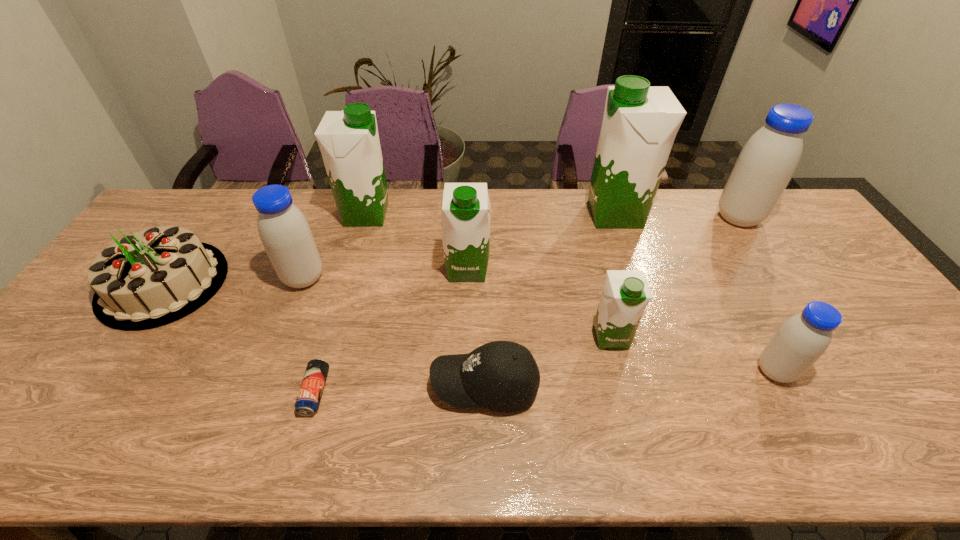
At what (x,y) coordinates should I click in order to perform the action: click on free point between the blue beer can and the second nearest green soya milk. Please return your answer as a coordinate pair (x, y). The width and height of the screenshot is (960, 540). Looking at the image, I should click on (392, 331).

Locate an element on the screen. This screenshot has height=540, width=960. free space between the smallest green soya milk and the leftmost green soya milk is located at coordinates (489, 275).

Identify the location of object that is the fourth closest one to the second biggest green soya milk. The height and width of the screenshot is (540, 960). (310, 392).

Locate an element on the screen. This screenshot has width=960, height=540. object identified as the eighth closest to the tallest object is located at coordinates (310, 392).

Where is `soya milk that is the seventh closest to the birthday cake`? soya milk that is the seventh closest to the birthday cake is located at coordinates (768, 160).

This screenshot has height=540, width=960. I want to click on soya milk identified as the second closest to the shortest object, so click(465, 220).

Identify which green soya milk is the closest to the second blue soya milk from left to right. Please provide its 2D coordinates. Your answer should be formatted as a tuple, i.e. [(x, y)], where the tuple contains the x and y coordinates of a point satisfying the conditions above.

[(626, 293)]

Point out which green soya milk is positioned as the third nearest to the birthday cake. Please provide its 2D coordinates. Your answer should be formatted as a tuple, i.e. [(x, y)], where the tuple contains the x and y coordinates of a point satisfying the conditions above.

[(626, 293)]

Select which blue soya milk is the closest to the ninth tallest object. Please provide its 2D coordinates. Your answer should be formatted as a tuple, i.e. [(x, y)], where the tuple contains the x and y coordinates of a point satisfying the conditions above.

[(285, 233)]

Locate an element on the screen. The width and height of the screenshot is (960, 540). blue soya milk that is the closest one to the biggest blue soya milk is located at coordinates (800, 341).